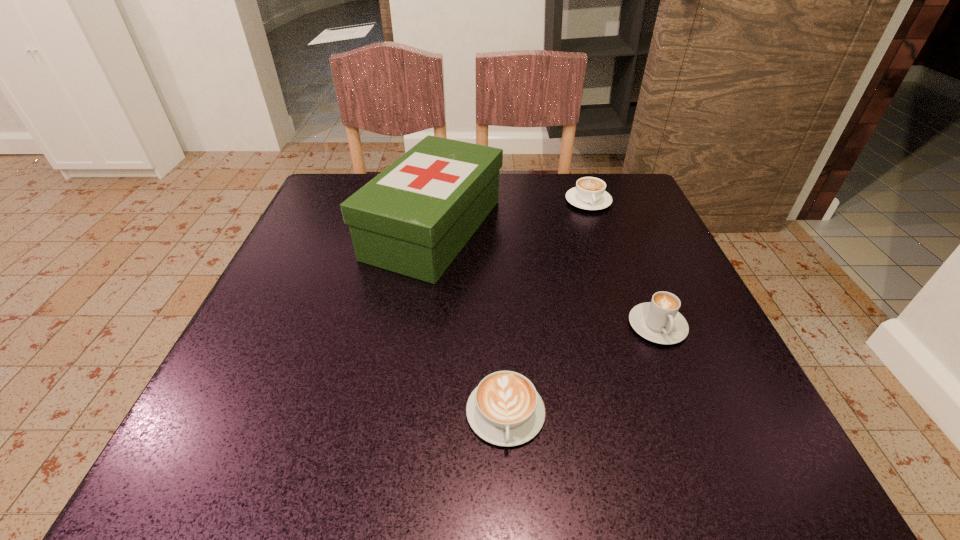
Find the location of a particular element. The height and width of the screenshot is (540, 960). vacant region at the far right corner of the desktop is located at coordinates (612, 177).

Locate an element on the screen. Image resolution: width=960 pixels, height=540 pixels. vacant area at the near right corner of the desktop is located at coordinates (681, 469).

Where is `free area in between the farthest cappuccino and the second farthest cappuccino`? This screenshot has height=540, width=960. free area in between the farthest cappuccino and the second farthest cappuccino is located at coordinates (623, 264).

Find the location of a particular element. The height and width of the screenshot is (540, 960). vacant space that is in between the farthest cappuccino and the second tallest object is located at coordinates (623, 264).

The width and height of the screenshot is (960, 540). Find the location of `free area in between the farthest cappuccino and the tallest object`. free area in between the farthest cappuccino and the tallest object is located at coordinates (511, 215).

Image resolution: width=960 pixels, height=540 pixels. In order to click on free space between the nearest object and the farthest cappuccino in this screenshot , I will do `click(547, 307)`.

Identify the location of vacant area that lies between the nearest object and the tallest object. (469, 321).

The width and height of the screenshot is (960, 540). What are the coordinates of `unoccupied position between the leftmost cappuccino and the farthest cappuccino` in the screenshot? It's located at (547, 307).

The width and height of the screenshot is (960, 540). In order to click on vacant space that is in between the farthest cappuccino and the tallest object in this screenshot , I will do `click(511, 215)`.

Locate an element on the screen. Image resolution: width=960 pixels, height=540 pixels. free area in between the first-aid kit and the nearest cappuccino is located at coordinates (469, 321).